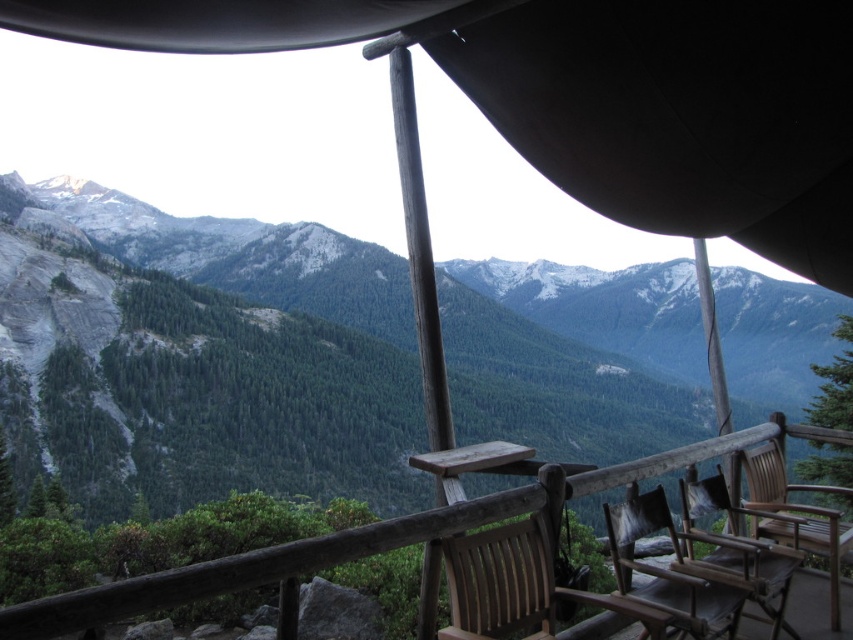
Which is more to the right, wooden porch at center or wooden chair at lower right?

wooden chair at lower right is more to the right.

Can you confirm if wooden porch at center is thinner than wooden chair at lower right?

No.

Between point (0, 609) and point (780, 573), which one is positioned in front?

Point (0, 609) is in front.

Where is `wooden porch at center`? Image resolution: width=853 pixels, height=640 pixels. wooden porch at center is located at coordinates (357, 540).

Does green textured forest at center have a smaller size compared to wooden chair at right?

No.

Can you confirm if green textured forest at center is positioned to the right of wooden chair at right?

No, green textured forest at center is not to the right of wooden chair at right.

Locate an element on the screen. Image resolution: width=853 pixels, height=640 pixels. green textured forest at center is located at coordinates (242, 353).

I want to click on green textured forest at center, so click(242, 353).

Is wooden textured chair at center to the left of wooden chair at lower right from the viewer's perspective?

Yes, wooden textured chair at center is to the left of wooden chair at lower right.

How much distance is there between wooden textured chair at center and wooden chair at lower right?

wooden textured chair at center and wooden chair at lower right are 3.11 meters apart from each other.

Where is `wooden textured chair at center`? The height and width of the screenshot is (640, 853). wooden textured chair at center is located at coordinates (668, 570).